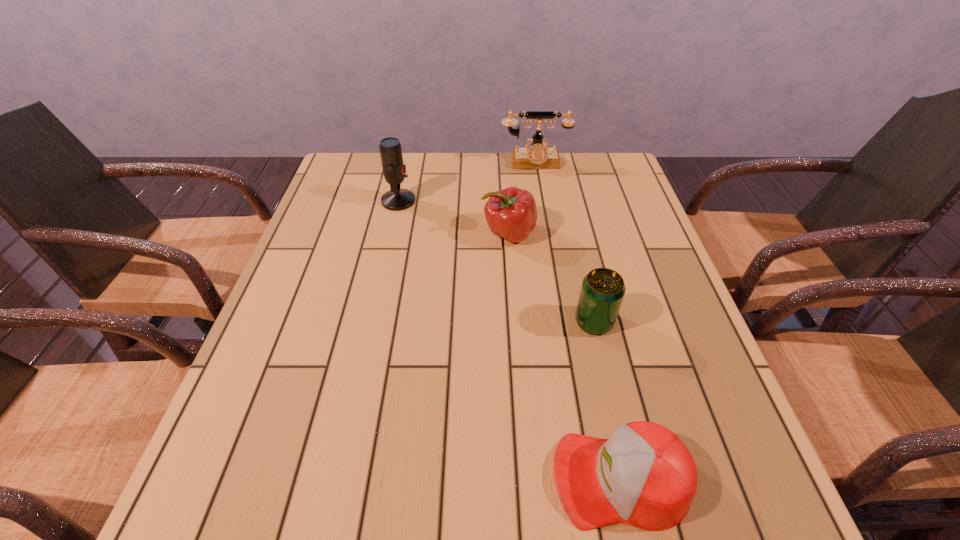
What are the coordinates of `free point that satisfies the following two spatial constraints: 1. on the side of the leftmost object with the red ring; 2. on the right side of the second nearest object` in the screenshot? It's located at (372, 322).

You are a GUI agent. You are given a task and a screenshot of the screen. Output one action in this format:
    pyautogui.click(x=<x>, y=<y>)
    Task: Click on the free space that satisfies the following two spatial constraints: 1. on the front side of the fourth farthest object; 2. on the front-facing side of the baseball cap
    This screenshot has height=540, width=960.
    Given the screenshot: What is the action you would take?
    pyautogui.click(x=631, y=479)

Where is `blank area in the image that satisfies the following two spatial constraints: 1. on the dial of the telephone; 2. on the side of the microphone with the red ring`? The image size is (960, 540). blank area in the image that satisfies the following two spatial constraints: 1. on the dial of the telephone; 2. on the side of the microphone with the red ring is located at coordinates (540, 201).

The width and height of the screenshot is (960, 540). Find the location of `blank area in the image that satisfies the following two spatial constraints: 1. on the side of the leftmost object with the red ring; 2. on the right side of the fourth farthest object`. blank area in the image that satisfies the following two spatial constraints: 1. on the side of the leftmost object with the red ring; 2. on the right side of the fourth farthest object is located at coordinates (372, 322).